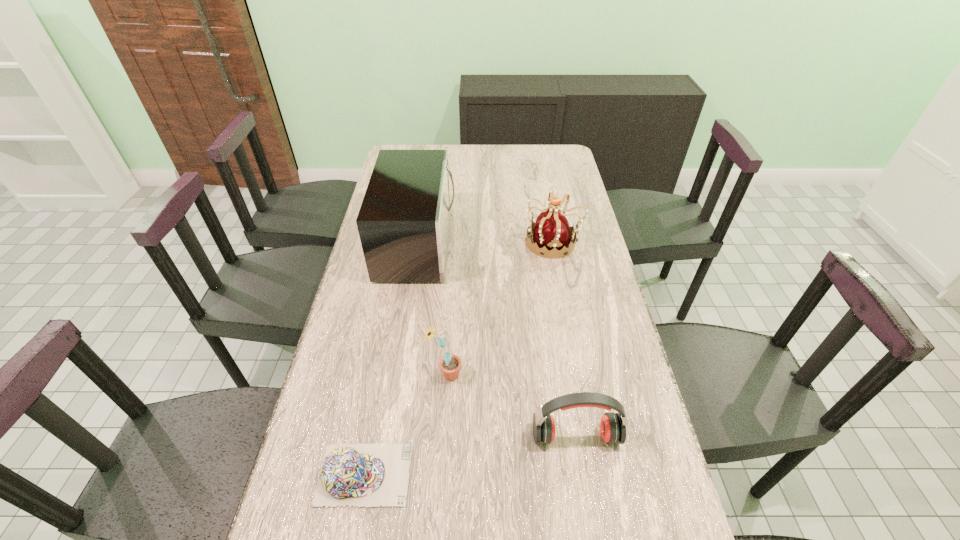
Find the location of `free space located 0.180m on the ear cups of the earphone`. free space located 0.180m on the ear cups of the earphone is located at coordinates (592, 536).

Identify the location of vacant area located 0.220m on the front, side, and top of the shortest object. This screenshot has height=540, width=960. (508, 474).

Identify the location of microwave oven that is at the left edge. (404, 220).

Find the location of a particular element. This screenshot has width=960, height=540. cap that is positioned at the left edge is located at coordinates (370, 475).

The height and width of the screenshot is (540, 960). Find the location of `tiara at the right edge`. tiara at the right edge is located at coordinates (552, 234).

You are a GUI agent. You are given a task and a screenshot of the screen. Output one action in this format:
    pyautogui.click(x=<x>, y=<y>)
    Task: Click on the earphone located in the right edge section of the desktop
    
    Given the screenshot: What is the action you would take?
    pyautogui.click(x=613, y=425)

This screenshot has width=960, height=540. In the image, there is a desktop. Identify the location of vacant space at the far edge. (519, 145).

The width and height of the screenshot is (960, 540). What are the coordinates of `vacant space at the left edge of the desktop` in the screenshot? It's located at click(x=354, y=287).

Where is `vacant space at the right edge`? vacant space at the right edge is located at coordinates (566, 217).

The height and width of the screenshot is (540, 960). In order to click on vacant space at the far right corner of the desktop in this screenshot , I will do `click(569, 165)`.